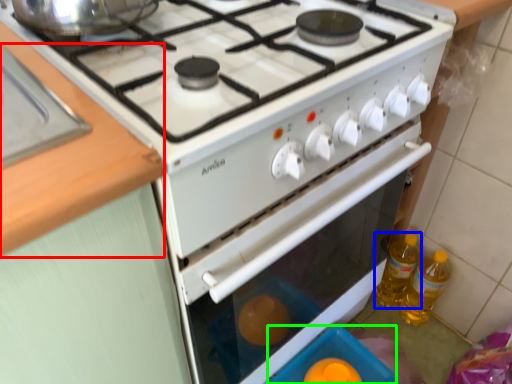
Question: Based on their relative distances, which object is farther from counter top (highlighted by a red box)? Choose from bottle (highlighted by a blue box) and appliance (highlighted by a green box).

Choices:
 (A) bottle
 (B) appliance

Answer: (A)